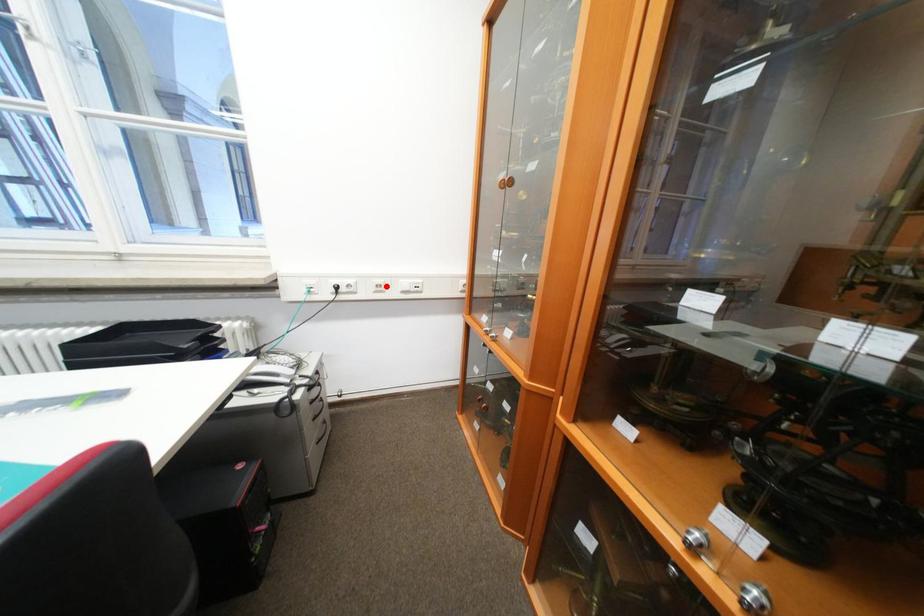
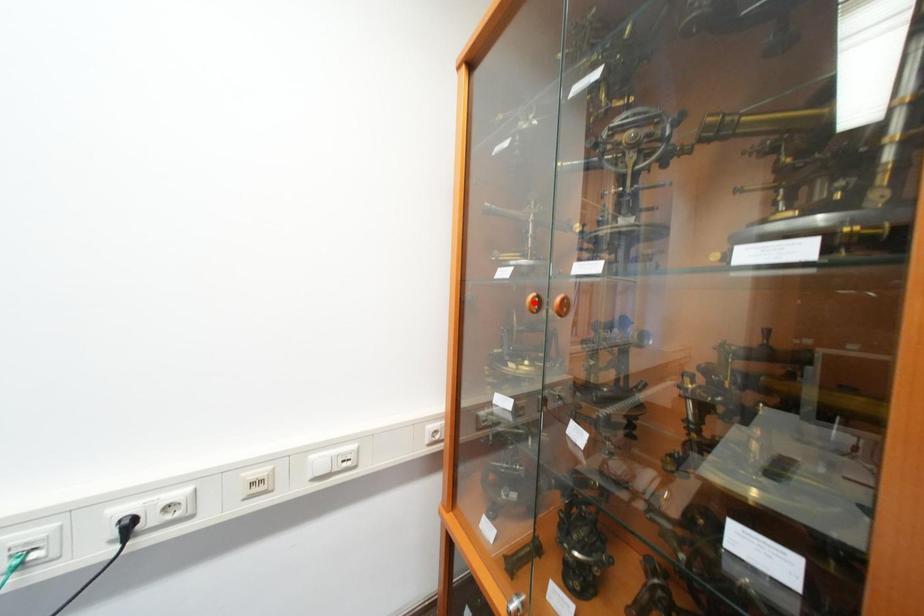
I am providing you with two images of the same scene from different viewpoints. A red point is marked on the first image and another point is marked on the second image. Is the red point in image1 aligned with the point shown in image2?

No